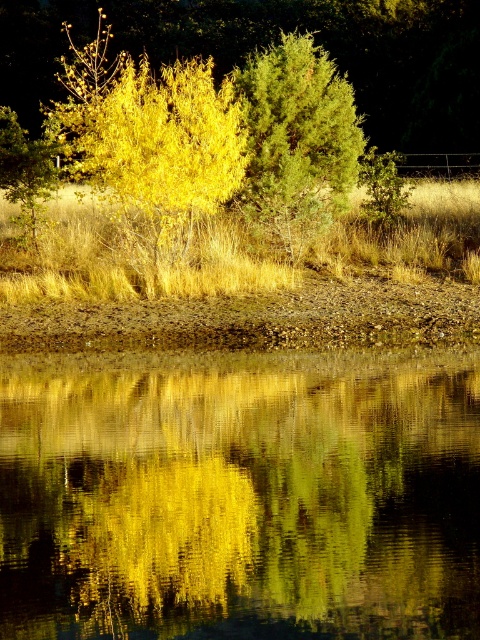
Question: Is green reflective water at center positioned at the back of green textured tree at center?

Choices:
 (A) yes
 (B) no

Answer: (B)

Question: Which of the following is the closest to the observer?

Choices:
 (A) (359, 125)
 (B) (93, 483)

Answer: (B)

Question: Is green reflective water at center in front of green textured tree at center?

Choices:
 (A) yes
 (B) no

Answer: (A)

Question: Is the position of green reflective water at center less distant than that of green textured tree at center?

Choices:
 (A) yes
 (B) no

Answer: (A)

Question: Considering the real-world distances, which object is farthest from the green reflective water at center?

Choices:
 (A) golden leafy tree at center
 (B) green textured tree at center

Answer: (B)

Question: Among these objects, which one is farthest from the camera?

Choices:
 (A) golden leafy tree at center
 (B) green reflective water at center
 (C) green textured tree at center

Answer: (C)